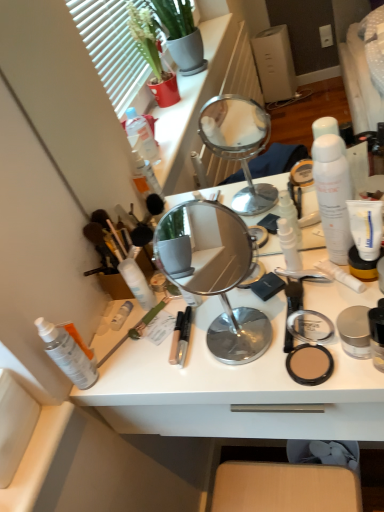
Identify the location of free space between transparent plastic spray bottle at lower left, the 1th toiletry from the left, and white matte tube at right, the first toothpaste when ordered from bottom to top. The width and height of the screenshot is (384, 512). (210, 331).